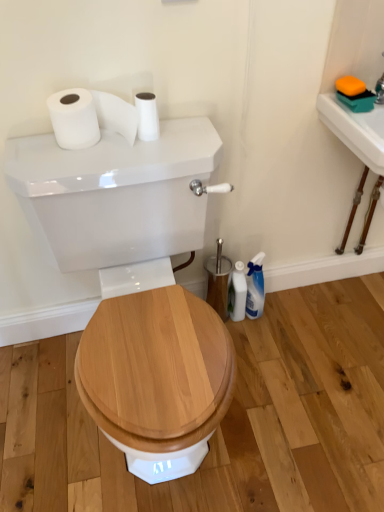
Image resolution: width=384 pixels, height=512 pixels. What are the coordinates of `vacant area that is in front of white glossy toilet brush at lower right` in the screenshot? It's located at (252, 351).